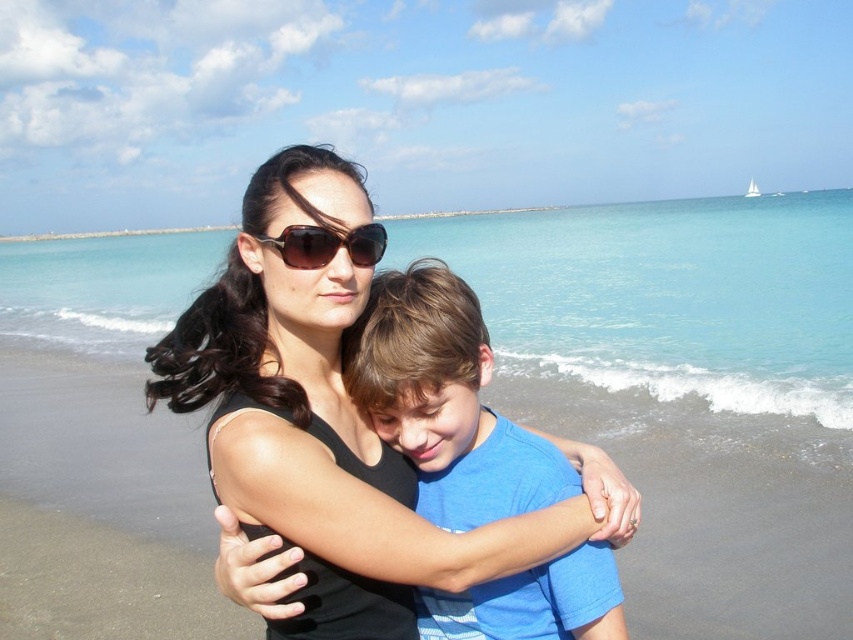
You are a photographer trying to capture the perfect shot of the blue cotton shirt at center and the brown reflective sunglasses at center. To ensure both are in frame, you need to know their relative positions. Which object is positioned to the right of the other?

The blue cotton shirt at center is to the right of the brown reflective sunglasses at center.

You are a photographer standing at the beach scene. You need to capture a photo of the blue cotton shirt at center and the brown reflective sunglasses at center. Which object should you focus on first if you want to capture both in the same frame without moving the camera?

The blue cotton shirt at center is located below the brown reflective sunglasses at center, so you should focus on the brown reflective sunglasses at center first to ensure both are in the same frame.

You are standing at the beach and want to take a photo of both the point at coordinates point [433,509] and point [285,236]. Which point should you focus on first to ensure both are in focus?

You should focus on point [285,236] first because it is closer to you than point [433,509], which is further away. This way, the depth of field will include both points in focus.